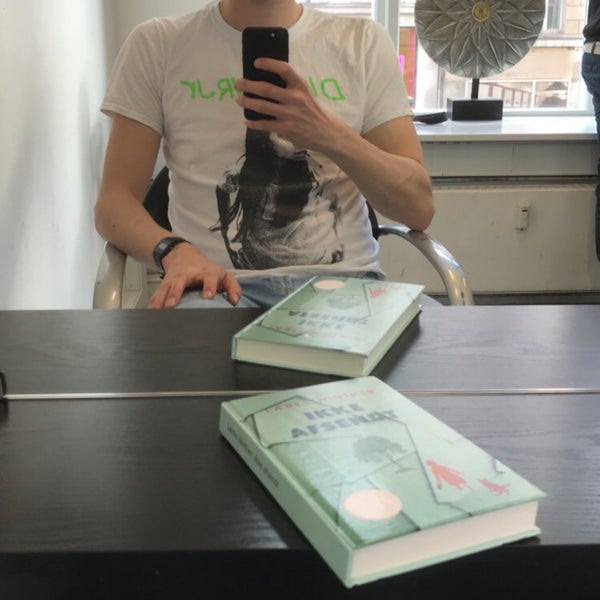
Identify the location of book. The height and width of the screenshot is (600, 600). (355, 440), (338, 307), (314, 357), (397, 327), (455, 528).